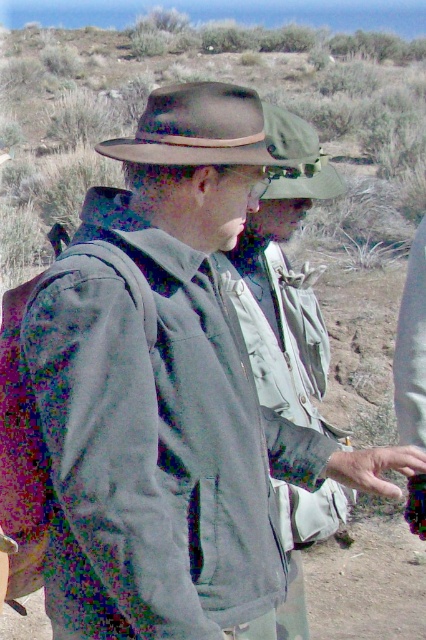
Is gray matte jacket at center thinner than matte brown cowboy hat at center?

Correct, gray matte jacket at center's width is less than matte brown cowboy hat at center's.

Between gray matte jacket at center and matte brown cowboy hat at center, which one has less height?

matte brown cowboy hat at center is shorter.

Is point (173, 412) closer to camera compared to point (210, 90)?

Yes.

Locate an element on the screen. gray matte jacket at center is located at coordinates (161, 448).

Can you confirm if gray matte jacket at center is smaller than green fabric cowboy hat at upper center?

No, gray matte jacket at center is not smaller than green fabric cowboy hat at upper center.

I want to click on gray matte jacket at center, so click(161, 448).

Which is above, matte brown cowboy hat at center or green fabric cowboy hat at upper center?

matte brown cowboy hat at center is higher up.

Between matte brown cowboy hat at center and green fabric cowboy hat at upper center, which one appears on the left side from the viewer's perspective?

matte brown cowboy hat at center is more to the left.

Locate an element on the screen. matte brown cowboy hat at center is located at coordinates (198, 129).

Where is `matte brown cowboy hat at center`? The width and height of the screenshot is (426, 640). matte brown cowboy hat at center is located at coordinates (198, 129).